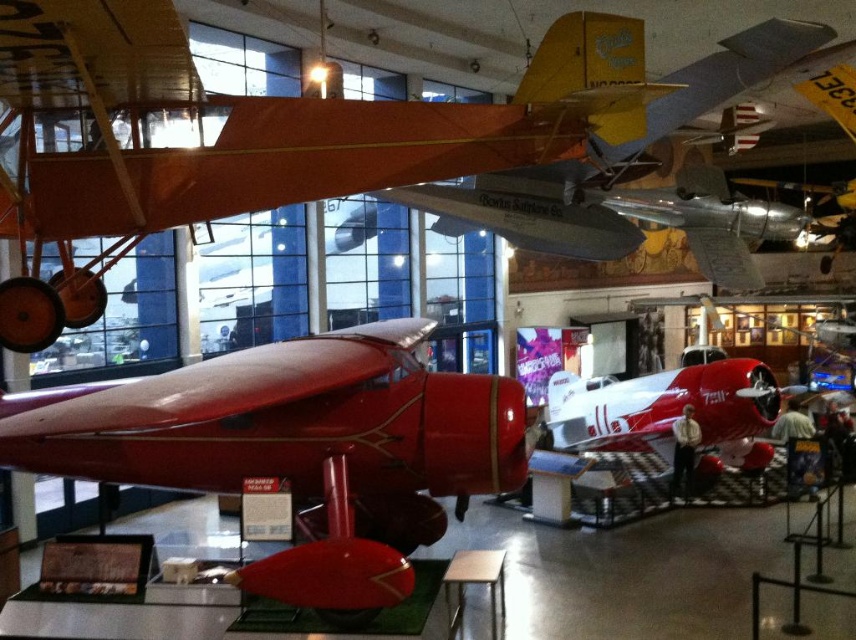
You are a visitor standing at the entrance of the aviation museum and see both the glossy red airplane at center and the polished red airplane at center. Which airplane is closer to you?

The glossy red airplane at center is closer to you since it is in front of the polished red airplane at center.

You are an aviation enthusiast visiting the museum and want to take a photo of both the matte red airplane at center and the polished red airplane at center. Since you have a wide angle lens, you need to know if they are stacked vertically or horizontally. Can you tell me their arrangement?

The matte red airplane at center is located above the polished red airplane at center, so they are stacked vertically.

You are standing at the entrance of the aviation museum and want to take a photo of the glossy red airplane at center. The museum has a rule that visitors must stay at least 1 meter away from all exhibits. If you are currently at the entrance located at point A, which is at coordinates point A at point 0.500, 0.500, can you take the photo without violating the museum rules?

Since the glossy red airplane at center is located at point [299,448], and you are at point A at point [428,320], the distance between you and the airplane is sqrt of the sum of the squares of the differences in coordinates. Calculating the distance between the two points, the distance is sqrt of the squares of 0.200 and 0.150, which is sqrt of 0.04 plus 0.0225 equals sqrt of 0.0625 equals 0.25 meters. Since 0.25 meters is less than 1 meter, you are too close to the airplane and cannot take the photo.